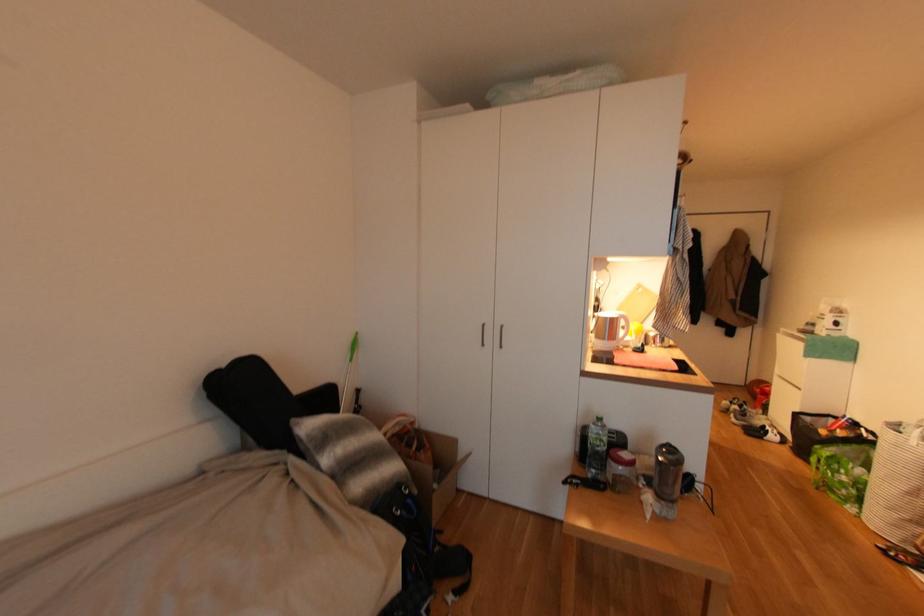
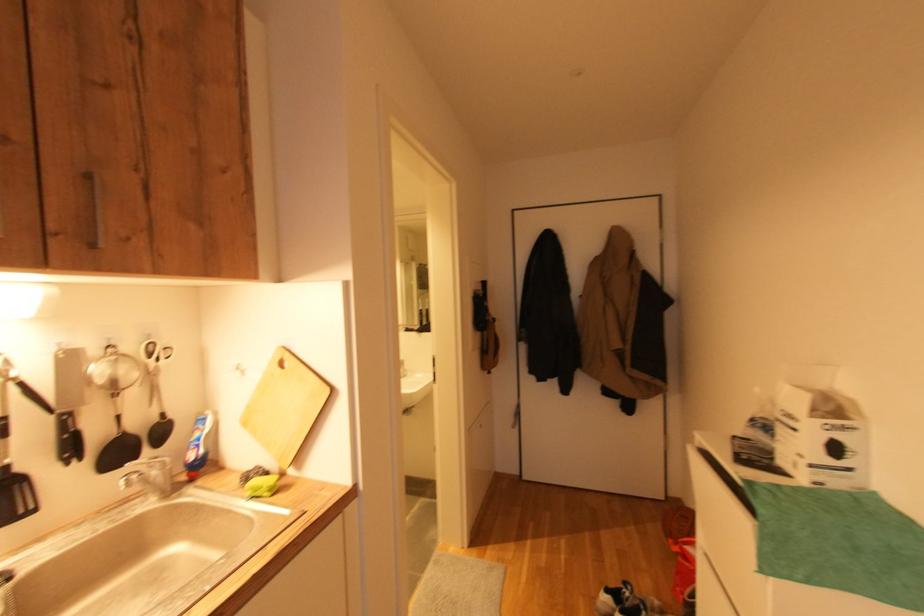
The images are taken continuously from a first-person perspective. In which direction are you moving?

The cameraman moved toward right, forward.